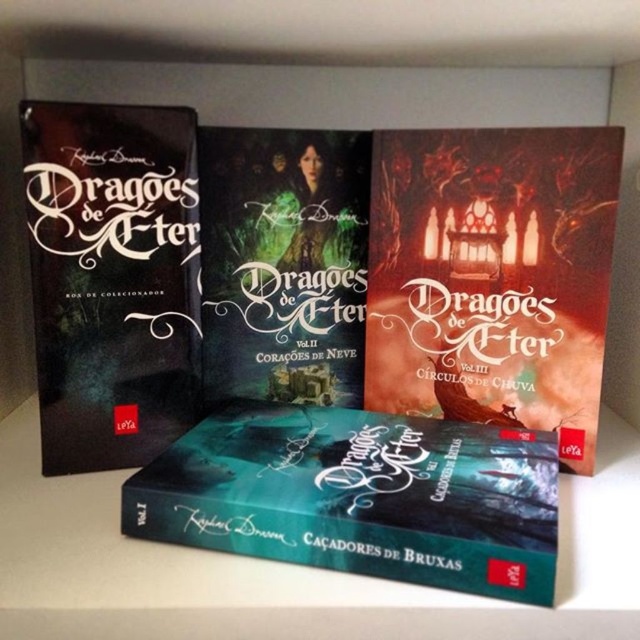
Question: Among these objects, which one is farthest from the camera?

Choices:
 (A) black matte book at left
 (B) teal glossy book at center

Answer: (A)

Question: Does dark matte book at center appear under matte green paper book at center?

Choices:
 (A) yes
 (B) no

Answer: (A)

Question: Is teal glossy book at center wider than black matte book at left?

Choices:
 (A) no
 (B) yes

Answer: (B)

Question: Which object appears farthest from the camera in this image?

Choices:
 (A) teal glossy book at center
 (B) matte green paper book at center

Answer: (B)

Question: Based on their relative distances, which object is farther from the dark matte book at center?

Choices:
 (A) teal glossy book at center
 (B) matte green paper book at center

Answer: (A)

Question: Is black matte book at left positioned behind matte green paper book at center?

Choices:
 (A) yes
 (B) no

Answer: (B)